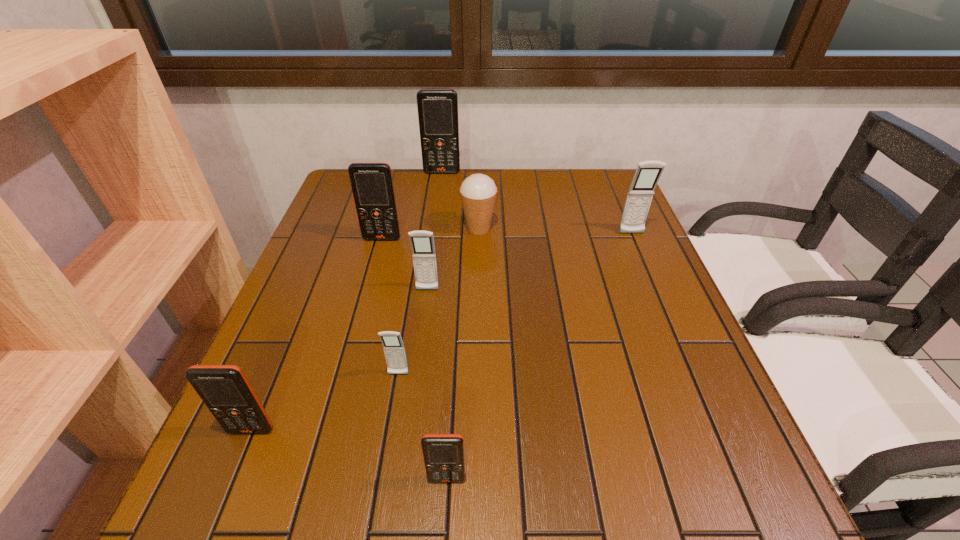
Find the location of a particular element. icecream is located at coordinates (478, 192).

Locate an element on the screen. This screenshot has height=540, width=960. the nearest orange cellular telephone is located at coordinates (443, 454).

Find the location of a particular element. The image size is (960, 540). the smallest orange cellular telephone is located at coordinates (443, 454).

I want to click on the smallest gray cellular telephone, so click(394, 350).

Locate an element on the screen. Image resolution: width=960 pixels, height=540 pixels. the nearest gray cellular telephone is located at coordinates (394, 350).

At what (x,y) coordinates should I click in order to perform the action: click on vacant area situated 0.160m on the screen of the biggest orange cellular telephone. Please return your answer as a coordinate pair (x, y). Looking at the image, I should click on (439, 201).

This screenshot has width=960, height=540. Identify the location of free space located 0.180m on the front-facing side of the farthest gray cellular telephone. (652, 281).

Locate an element on the screen. The height and width of the screenshot is (540, 960). free space located on the screen of the second orange cellular telephone from left to right is located at coordinates (376, 261).

This screenshot has width=960, height=540. In order to click on blank space located on the front-facing side of the second nearest gray cellular telephone in this screenshot , I will do `click(424, 312)`.

Where is `vacant space located 0.120m on the screen of the seventh farthest object`? This screenshot has width=960, height=540. vacant space located 0.120m on the screen of the seventh farthest object is located at coordinates (219, 508).